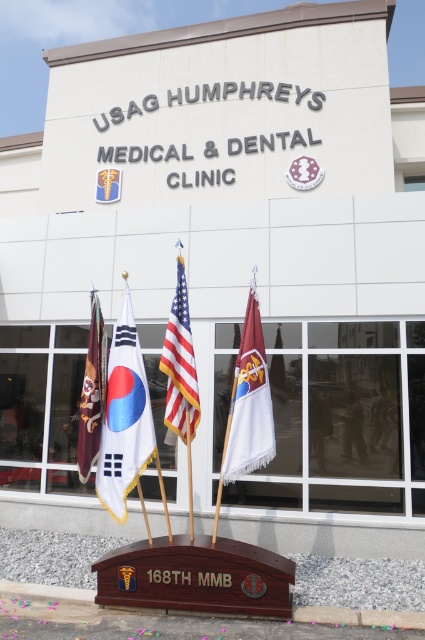
Question: Estimate the real-world distances between objects in this image. Which object is closer to the maroon fabric flag at center?

Choices:
 (A) polished wood flag at center
 (B) brown leather flag at left

Answer: (A)

Question: Which object is the farthest from the white fabric flag at center?

Choices:
 (A) polished wood flag at center
 (B) brown leather flag at left

Answer: (A)

Question: Is maroon fabric flag at center closer to the viewer compared to brown leather flag at left?

Choices:
 (A) no
 (B) yes

Answer: (B)

Question: Considering the real-world distances, which object is farthest from the polished wood flag at center?

Choices:
 (A) brown leather flag at left
 (B) white fabric flag at center

Answer: (A)

Question: Is the position of maroon fabric flag at center more distant than that of brown leather flag at left?

Choices:
 (A) yes
 (B) no

Answer: (B)

Question: In this image, where is polished wood flag at center located relative to brown leather flag at left?

Choices:
 (A) left
 (B) right

Answer: (B)